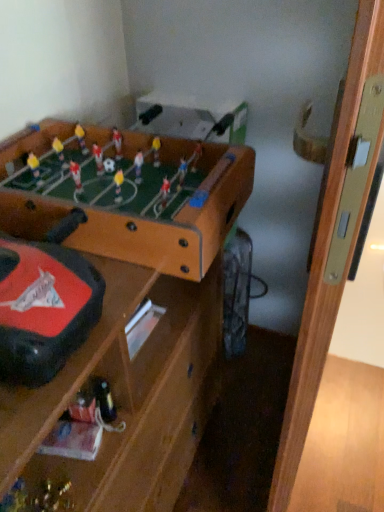
Question: From a real-world perspective, relative to brown wooden table at upper left, which ranks as the first table in top-to-bottom order, is metallic gold trophy at lower left vertically above or below?

Choices:
 (A) below
 (B) above

Answer: (A)

Question: Looking at their shapes, would you say metallic gold trophy at lower left is wider or thinner than brown wooden table at upper left, which ranks as the first table in top-to-bottom order?

Choices:
 (A) wide
 (B) thin

Answer: (B)

Question: Estimate the real-world distances between objects in this image. Which object is farther from the metallic gold trophy at lower left?

Choices:
 (A) brown wooden table at center, which is the 1th table from bottom to top
 (B) brown wooden table at upper left, which ranks as the first table in top-to-bottom order

Answer: (B)

Question: Estimate the real-world distances between objects in this image. Which object is closer to the brown wooden table at center, the 2th table from the top?

Choices:
 (A) metallic gold trophy at lower left
 (B) brown wooden table at upper left, which ranks as the first table in top-to-bottom order

Answer: (B)